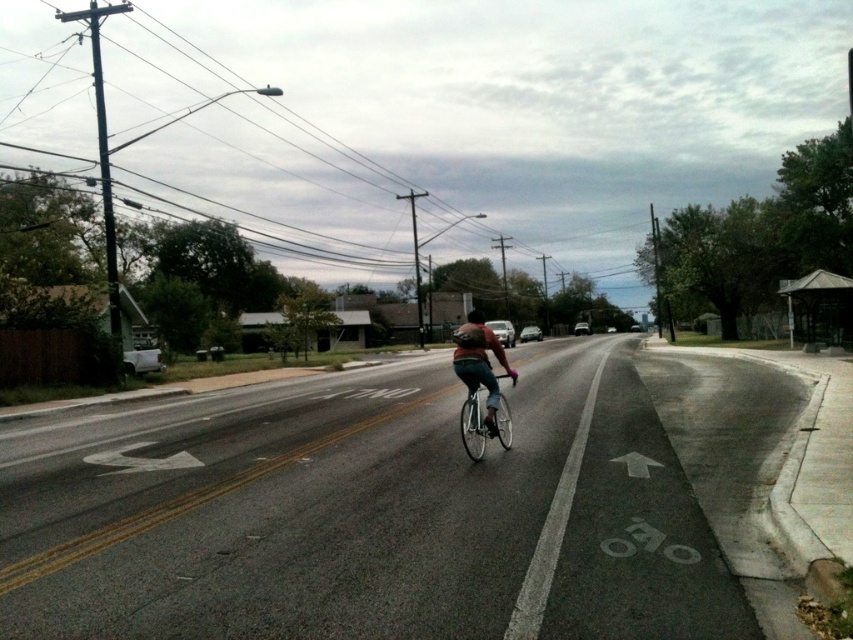
Between matte black bicycle at center and black matte bicycle helmet at center, which one appears on the right side from the viewer's perspective?

matte black bicycle at center is more to the right.

Consider the image. Between matte black bicycle at center and black matte bicycle helmet at center, which one has less height?

With less height is black matte bicycle helmet at center.

Where is `matte black bicycle at center`? Image resolution: width=853 pixels, height=640 pixels. matte black bicycle at center is located at coordinates (480, 385).

Which is below, silver metallic bicycle at center or black matte bicycle helmet at center?

silver metallic bicycle at center is lower down.

Who is more distant from viewer, (463,417) or (469,324)?

The point (469,324) is more distant.

Identify the location of silver metallic bicycle at center. The image size is (853, 640). (483, 424).

Locate an element on the screen. The image size is (853, 640). silver metallic bicycle at center is located at coordinates (483, 424).

Can you confirm if matte black bicycle at center is wider than silver metallic bicycle at center?

Yes.

This screenshot has height=640, width=853. Describe the element at coordinates (480, 385) in the screenshot. I see `matte black bicycle at center` at that location.

The image size is (853, 640). Identify the location of matte black bicycle at center. (480, 385).